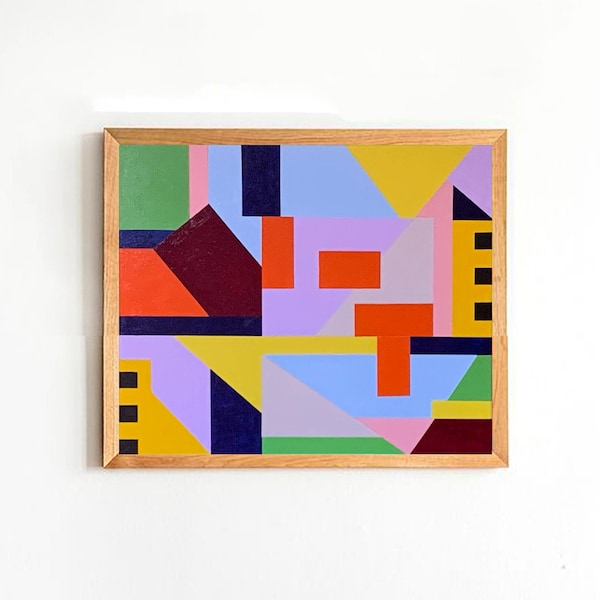
You are a GUI agent. You are given a task and a screenshot of the screen. Output one action in this format:
    pyautogui.click(x=<x>, y=<y>)
    Task: Click on the bottom rightmost corner of wooden frame
    
    Given the screenshot: What is the action you would take?
    pyautogui.click(x=505, y=464)